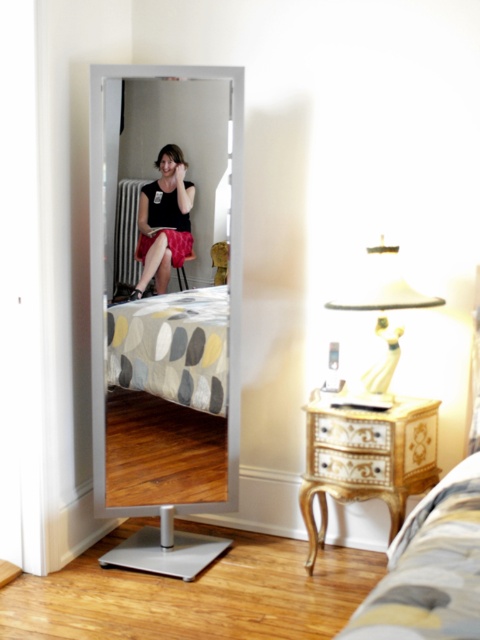
Question: Which object is closer to the camera taking this photo?

Choices:
 (A) striped fabric bed at lower right
 (B) gold ornate dresser at lower right
 (C) matte black skirt at center

Answer: (A)

Question: Where is striped fabric bed at lower right located in relation to matte black skirt at center in the image?

Choices:
 (A) right
 (B) left

Answer: (A)

Question: Which object appears closest to the camera in this image?

Choices:
 (A) silver metallic mirror at center
 (B) matte pink fabric dress at center
 (C) striped fabric bed at lower right
 (D) matte black skirt at center

Answer: (C)

Question: Is matte black skirt at center to the right of matte pink fabric dress at center from the viewer's perspective?

Choices:
 (A) no
 (B) yes

Answer: (A)

Question: Which object is closer to the camera taking this photo?

Choices:
 (A) gold ornate dresser at lower right
 (B) silver metallic mirror at center
 (C) matte pink fabric dress at center

Answer: (A)

Question: Is silver metallic mirror at center further to the viewer compared to matte pink fabric dress at center?

Choices:
 (A) no
 (B) yes

Answer: (A)